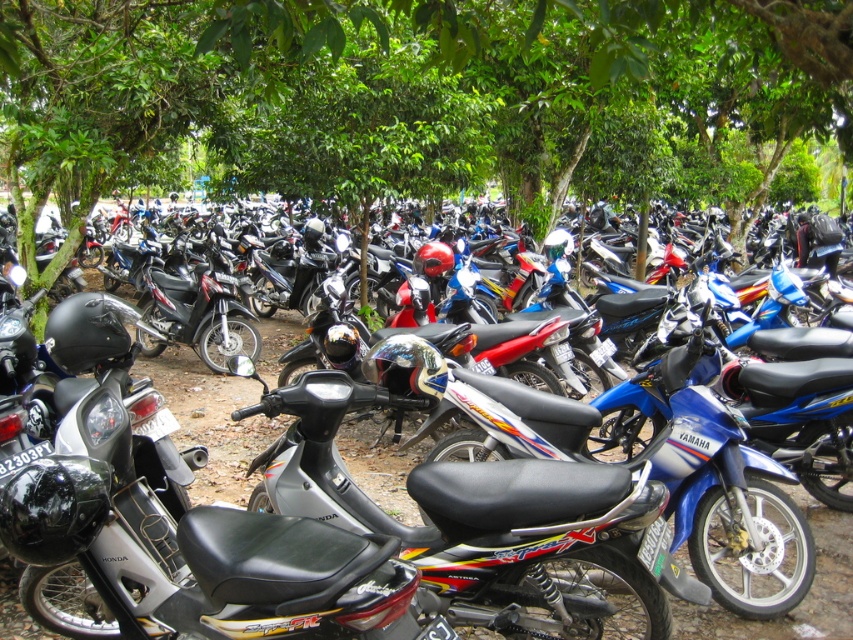
Which is behind, point (35, 154) or point (244, 394)?

Positioned behind is point (244, 394).

Does green leafy tree at center appear on the left side of silver metallic scooter at center?

Incorrect, green leafy tree at center is not on the left side of silver metallic scooter at center.

Where is `green leafy tree at center`? green leafy tree at center is located at coordinates (412, 93).